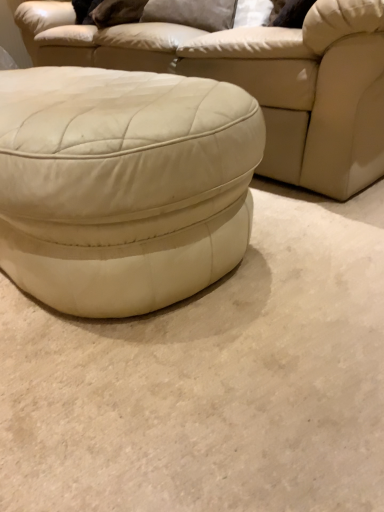
Question: Considering the relative sizes of white leather ottoman at center and matte white ottoman at center in the image provided, is white leather ottoman at center bigger than matte white ottoman at center?

Choices:
 (A) yes
 (B) no

Answer: (B)

Question: From the image's perspective, is white leather ottoman at center beneath matte white ottoman at center?

Choices:
 (A) no
 (B) yes

Answer: (B)

Question: Is white leather ottoman at center behind matte white ottoman at center?

Choices:
 (A) no
 (B) yes

Answer: (A)

Question: Is white leather ottoman at center facing away from matte white ottoman at center?

Choices:
 (A) no
 (B) yes

Answer: (B)

Question: Can we say white leather ottoman at center lies outside matte white ottoman at center?

Choices:
 (A) no
 (B) yes

Answer: (B)

Question: Does white leather ottoman at center have a greater width compared to matte white ottoman at center?

Choices:
 (A) no
 (B) yes

Answer: (A)

Question: Would you say white leather ottoman at center is part of matte white ottoman at center's contents?

Choices:
 (A) no
 (B) yes

Answer: (A)

Question: Considering the relative positions of matte white ottoman at center and white leather ottoman at center in the image provided, is matte white ottoman at center to the right of white leather ottoman at center from the viewer's perspective?

Choices:
 (A) no
 (B) yes

Answer: (A)

Question: Can you confirm if matte white ottoman at center is shorter than white leather ottoman at center?

Choices:
 (A) no
 (B) yes

Answer: (A)

Question: Is matte white ottoman at center taller than white leather ottoman at center?

Choices:
 (A) no
 (B) yes

Answer: (B)

Question: Is matte white ottoman at center outside white leather ottoman at center?

Choices:
 (A) yes
 (B) no

Answer: (A)

Question: From a real-world perspective, is matte white ottoman at center positioned under white leather ottoman at center based on gravity?

Choices:
 (A) yes
 (B) no

Answer: (B)

Question: Can you confirm if suede-like gray pillow at upper center is positioned to the left of white leather ottoman at center?

Choices:
 (A) no
 (B) yes

Answer: (A)